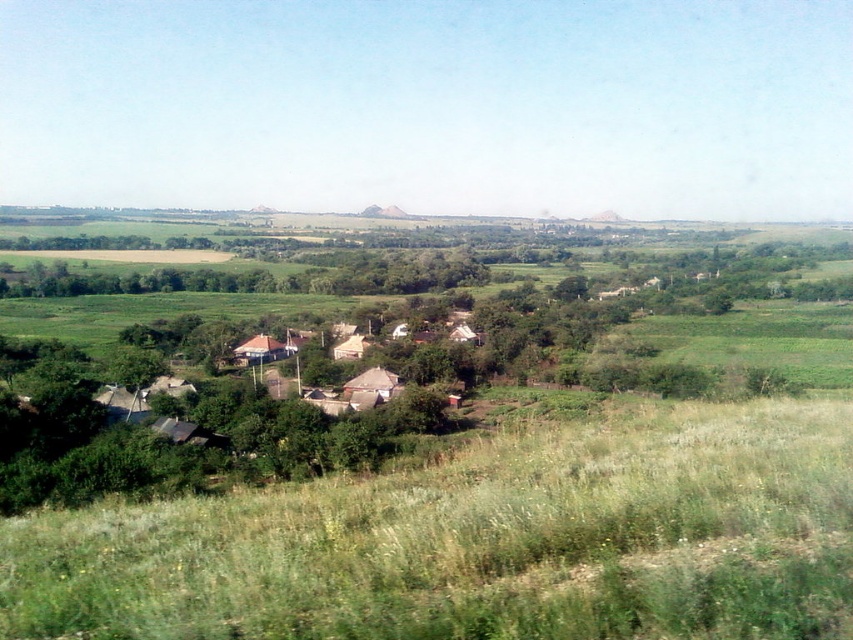
You are a farmer planning to plant crops in the green grassy field at lower center and the green grassy field at right. Which field has a smaller width for planting?

The green grassy field at lower center has a smaller width than the green grassy field at right, so it is the smaller one for planting.

Consider the image. You are standing at the point labeled as point [480,541] in the image. Looking around, you see the green grassy field at lower center. Which direction should you walk to reach the village houses in the middle ground?

The point [480,541] is located in the green grassy field at lower center. To reach the village houses in the middle ground, you should walk upwards towards the middle of the image where the cluster of small houses is situated.

You are standing in the middle of the green grassy field at lower center and want to walk towards the green grassy field at right. Which direction should you face to move towards it?

The green grassy field at lower center is positioned under the green grassy field at right, so you should face upwards to move towards the green grassy field at right.